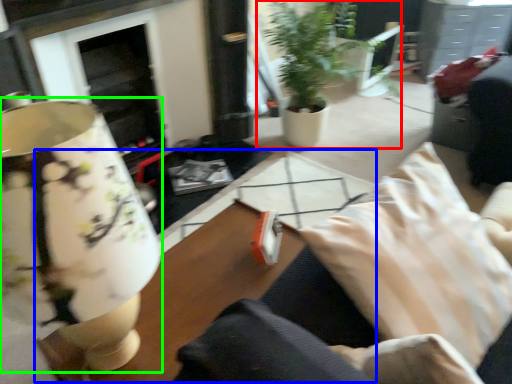
Question: Based on their relative distances, which object is nearer to houseplant (highlighted by a red box)? Choose from table (highlighted by a blue box) and table lamp (highlighted by a green box).

Choices:
 (A) table
 (B) table lamp

Answer: (A)